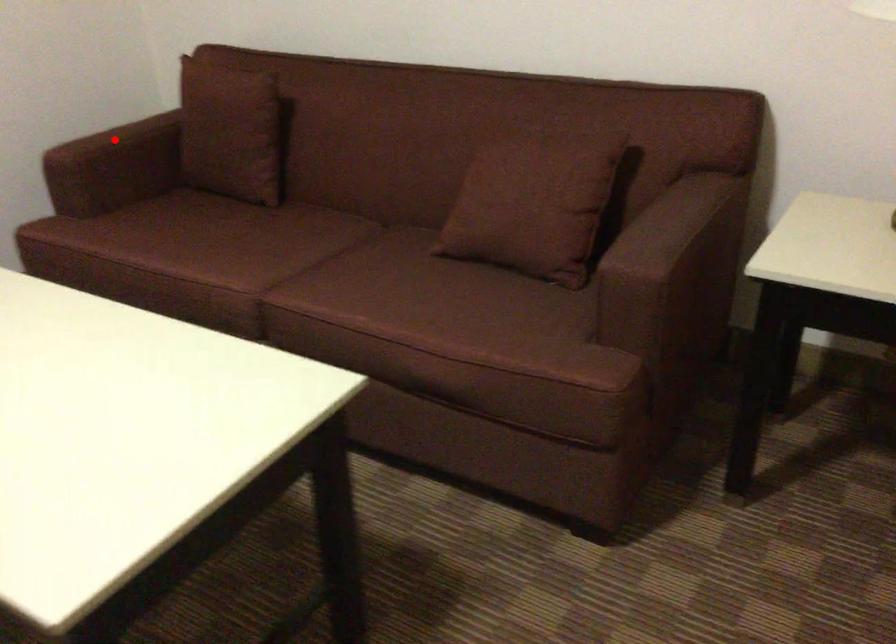
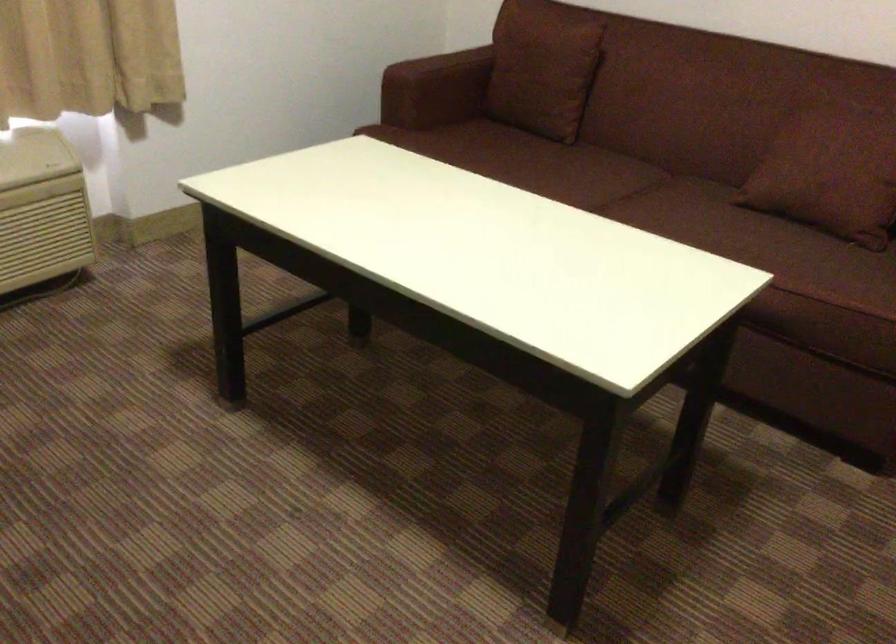
Question: I am providing you with two images of the same scene from different viewpoints. In image1, a red point is highlighted. Considering the same 3D point in image2, which of the following is correct?

Choices:
 (A) It is closer
 (B) It is farther

Answer: (B)